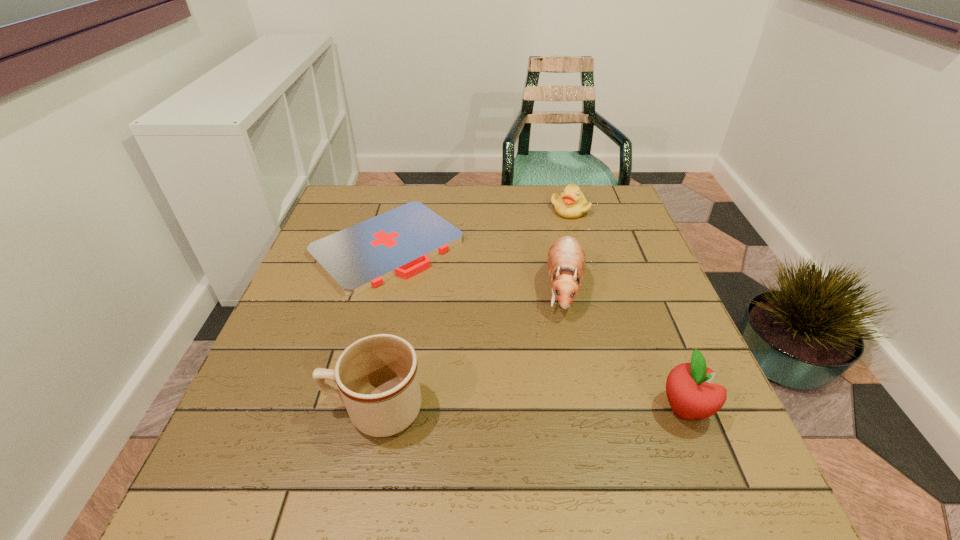
The image size is (960, 540). What are the coordinates of `mug` in the screenshot? It's located at (377, 376).

Where is `the rightmost object`? Image resolution: width=960 pixels, height=540 pixels. the rightmost object is located at coordinates (689, 390).

Image resolution: width=960 pixels, height=540 pixels. Find the location of `the first-aid kit`. the first-aid kit is located at coordinates (400, 242).

This screenshot has height=540, width=960. I want to click on duckling, so click(x=571, y=204).

The width and height of the screenshot is (960, 540). What are the coordinates of `hamster` in the screenshot? It's located at (566, 258).

Find the location of a particular element. This screenshot has height=540, width=960. vacant region located 0.130m on the side of the mug with the handle is located at coordinates (257, 409).

Image resolution: width=960 pixels, height=540 pixels. I want to click on vacant space located on the side of the mug with the handle, so click(247, 409).

I want to click on vacant space positioned on the side of the mug with the handle, so click(278, 409).

You are a GUI agent. You are given a task and a screenshot of the screen. Output one action in this format:
    pyautogui.click(x=<x>, y=<y>)
    Task: Click on the vacant area situated 0.150m on handle side the shortest object
    
    Given the screenshot: What is the action you would take?
    pyautogui.click(x=470, y=316)

Locate an element on the screen. The height and width of the screenshot is (540, 960). blank space located 0.130m on handle side the shortest object is located at coordinates (465, 312).